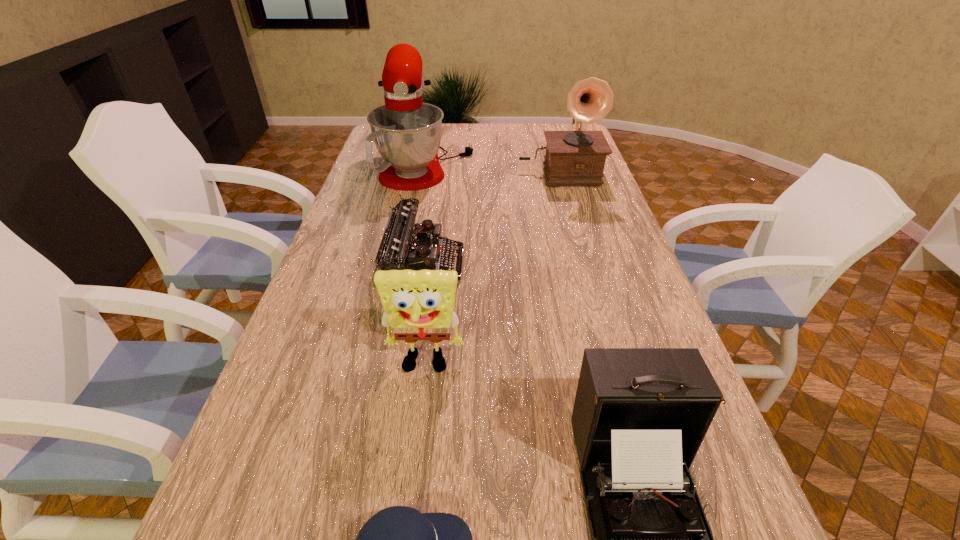
Identify the location of mixer. (407, 133).

The width and height of the screenshot is (960, 540). Identify the location of record player. (573, 158).

The width and height of the screenshot is (960, 540). What are the coordinates of `sponge` in the screenshot? It's located at (418, 305).

Where is `the farther typewriter`? The image size is (960, 540). the farther typewriter is located at coordinates pyautogui.click(x=402, y=248).

Find the location of `the fourth nearest object`. the fourth nearest object is located at coordinates (402, 248).

At what (x,y) coordinates should I click in order to perform the action: click on blank space located on the bowl side of the mixer. Please return your answer as a coordinate pair (x, y). Looking at the image, I should click on (530, 159).

Locate an element on the screen. free space located on the horn of the record player is located at coordinates (575, 234).

This screenshot has height=540, width=960. I want to click on free point located 0.060m on the face of the sponge, so click(420, 405).

Where is `free space located on the keyboard of the farther typewriter`? This screenshot has height=540, width=960. free space located on the keyboard of the farther typewriter is located at coordinates (584, 262).

This screenshot has width=960, height=540. I want to click on object that is at the far edge, so click(x=407, y=133).